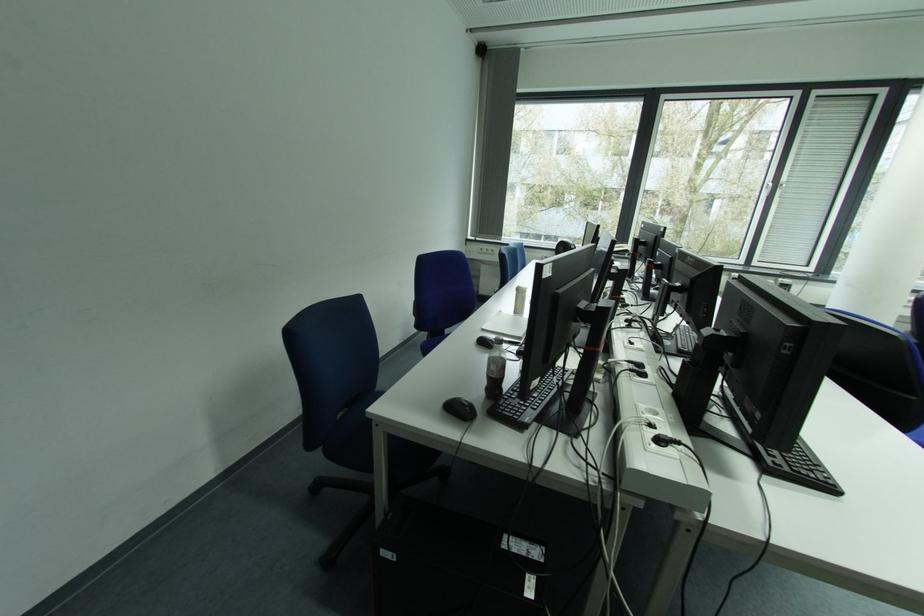
Find where to lift the soda bottle. Please return your answer as a coordinate pair (x, y).

(494, 370)